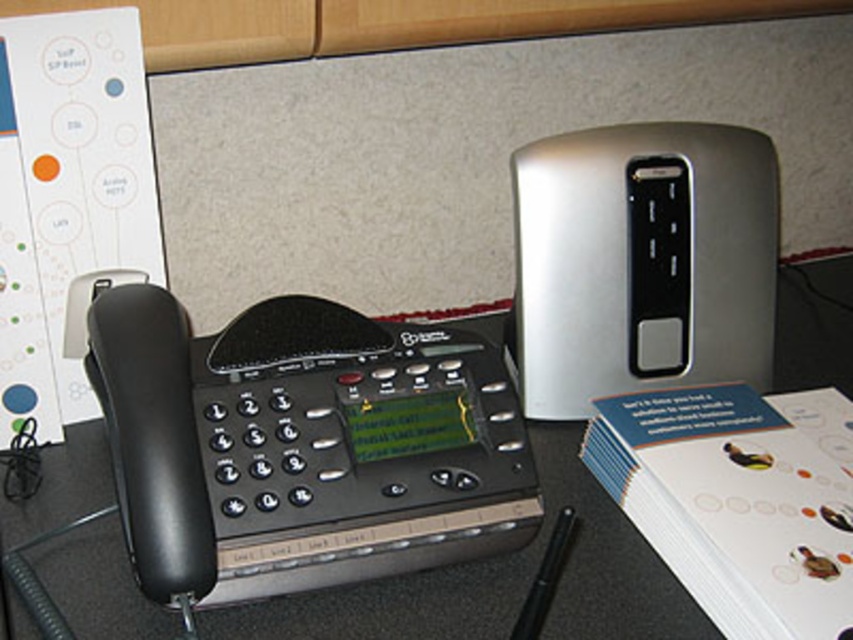
Is silver metallic speaker at upper right wider than black plastic phone at left?

Yes.

Is point (741, 172) more distant than point (828, 346)?

No.

Locate an element on the screen. This screenshot has width=853, height=640. silver metallic speaker at upper right is located at coordinates (642, 260).

Image resolution: width=853 pixels, height=640 pixels. Identify the location of silver metallic speaker at upper right. (642, 260).